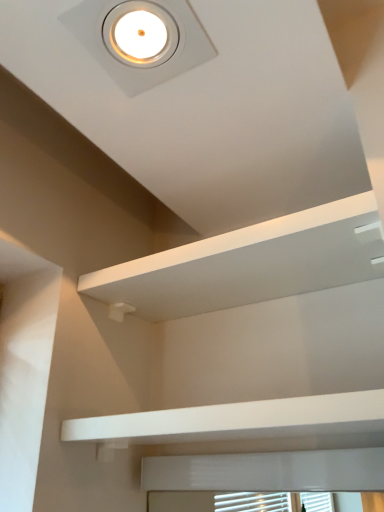
Image resolution: width=384 pixels, height=512 pixels. What do you see at coordinates (250, 263) in the screenshot?
I see `white matte shelf at upper center` at bounding box center [250, 263].

Locate an element on the screen. The width and height of the screenshot is (384, 512). white glossy droplight at upper center is located at coordinates click(140, 39).

This screenshot has width=384, height=512. I want to click on white matte/finish balustrade at lower center, so click(237, 420).

Considering the positions of objects white matte/finish balustrade at lower center and white glossy droplight at upper center in the image provided, who is more to the left, white matte/finish balustrade at lower center or white glossy droplight at upper center?

white glossy droplight at upper center is more to the left.

This screenshot has width=384, height=512. In order to click on balustrade that is under the white glossy droplight at upper center (from a real-world perspective) in this screenshot , I will do `click(237, 420)`.

Is white matte/finish balustrade at lower center not within white glossy droplight at upper center?

white matte/finish balustrade at lower center lies outside white glossy droplight at upper center's area.

From a real-world perspective, is white matte shelf at upper center located higher than white matte/finish balustrade at lower center?

Yes, from a real-world perspective, white matte shelf at upper center is over white matte/finish balustrade at lower center

Consider the image. In terms of height, does white matte shelf at upper center look taller or shorter compared to white matte/finish balustrade at lower center?

white matte shelf at upper center is taller than white matte/finish balustrade at lower center.

Does white matte shelf at upper center turn towards white matte/finish balustrade at lower center?

No, white matte shelf at upper center is not aimed at white matte/finish balustrade at lower center.

Which of these two, white matte shelf at upper center or white matte/finish balustrade at lower center, is wider?

With larger width is white matte shelf at upper center.

Does point (275, 403) come in front of point (360, 244)?

Yes.

Does white matte/finish balustrade at lower center come in front of white matte shelf at upper center?

Yes, white matte/finish balustrade at lower center is closer to the viewer.

Does white matte/finish balustrade at lower center turn towards white matte shelf at upper center?

No, white matte/finish balustrade at lower center is not facing towards white matte shelf at upper center.

Can you confirm if white matte/finish balustrade at lower center is taller than white matte shelf at upper center?

Incorrect, the height of white matte/finish balustrade at lower center is not larger of that of white matte shelf at upper center.

The width and height of the screenshot is (384, 512). Identify the location of droplight above the white matte shelf at upper center (from the image's perspective). (140, 39).

Can you confirm if white glossy droplight at upper center is shorter than white matte shelf at upper center?

Yes.

Is white glossy droplight at upper center thinner than white matte shelf at upper center?

Indeed, white glossy droplight at upper center has a lesser width compared to white matte shelf at upper center.

Is white glossy droplight at upper center inside or outside of white matte shelf at upper center?

white glossy droplight at upper center is not inside white matte shelf at upper center, it's outside.

From the image's perspective, does white matte shelf at upper center appear higher than white glossy droplight at upper center?

No, from the image's perspective, white matte shelf at upper center is not on top of white glossy droplight at upper center.

Is there a large distance between white matte shelf at upper center and white glossy droplight at upper center?

No.

Looking at the image, does white matte shelf at upper center seem bigger or smaller compared to white glossy droplight at upper center?

In the image, white matte shelf at upper center appears to be larger than white glossy droplight at upper center.

How much distance is there between white matte shelf at upper center and white glossy droplight at upper center?

They are 16.15 inches apart.

From a real-world perspective, is white glossy droplight at upper center located higher than white matte/finish balustrade at lower center?

Correct, in the physical world, white glossy droplight at upper center is higher than white matte/finish balustrade at lower center.

Considering the sizes of white glossy droplight at upper center and white matte/finish balustrade at lower center in the image, is white glossy droplight at upper center wider or thinner than white matte/finish balustrade at lower center?

Considering their sizes, white glossy droplight at upper center looks slimmer than white matte/finish balustrade at lower center.

Is white glossy droplight at upper center shorter than white matte/finish balustrade at lower center?

Yes.

Is white glossy droplight at upper center smaller than white matte/finish balustrade at lower center?

Indeed, white glossy droplight at upper center has a smaller size compared to white matte/finish balustrade at lower center.

Where is `balustrade below the white glossy droplight at upper center (from the image's perspective)`? This screenshot has height=512, width=384. balustrade below the white glossy droplight at upper center (from the image's perspective) is located at coordinates (237, 420).

I want to click on shelf behind the white matte/finish balustrade at lower center, so click(250, 263).

Estimate the real-world distances between objects in this image. Which object is closer to white matte shelf at upper center, white glossy droplight at upper center or white matte/finish balustrade at lower center?

white matte/finish balustrade at lower center lies closer to white matte shelf at upper center than the other object.

Considering their positions, is white matte shelf at upper center positioned closer to white glossy droplight at upper center than white matte/finish balustrade at lower center?

Based on the image, white matte shelf at upper center appears to be nearer to white glossy droplight at upper center.

From the image, which object appears to be farther from white matte/finish balustrade at lower center, white glossy droplight at upper center or white matte shelf at upper center?

white glossy droplight at upper center lies further to white matte/finish balustrade at lower center than the other object.

Estimate the real-world distances between objects in this image. Which object is closer to white matte/finish balustrade at lower center, white matte shelf at upper center or white glossy droplight at upper center?

Based on the image, white matte shelf at upper center appears to be nearer to white matte/finish balustrade at lower center.

Based on their spatial positions, is white matte/finish balustrade at lower center or white glossy droplight at upper center further from white matte shelf at upper center?

white glossy droplight at upper center is positioned further to the anchor white matte shelf at upper center.

Estimate the real-world distances between objects in this image. Which object is closer to white glossy droplight at upper center, white matte/finish balustrade at lower center or white matte shelf at upper center?

white matte shelf at upper center.

Where is `shelf between white glossy droplight at upper center and white matte/finish balustrade at lower center in the vertical direction`? shelf between white glossy droplight at upper center and white matte/finish balustrade at lower center in the vertical direction is located at coordinates (250, 263).